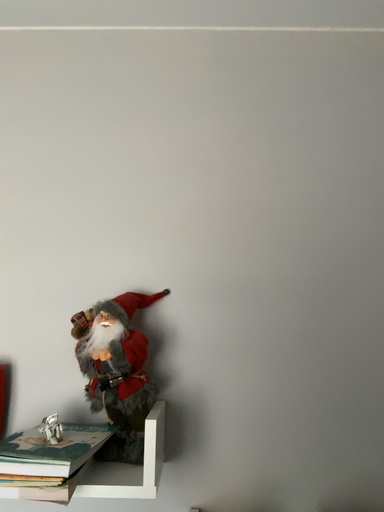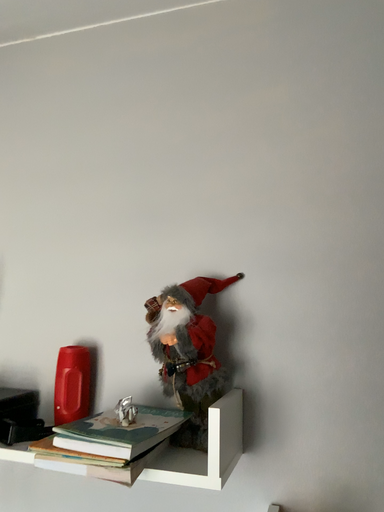
Question: Which way did the camera rotate in the video?

Choices:
 (A) rotated right
 (B) rotated left

Answer: (B)